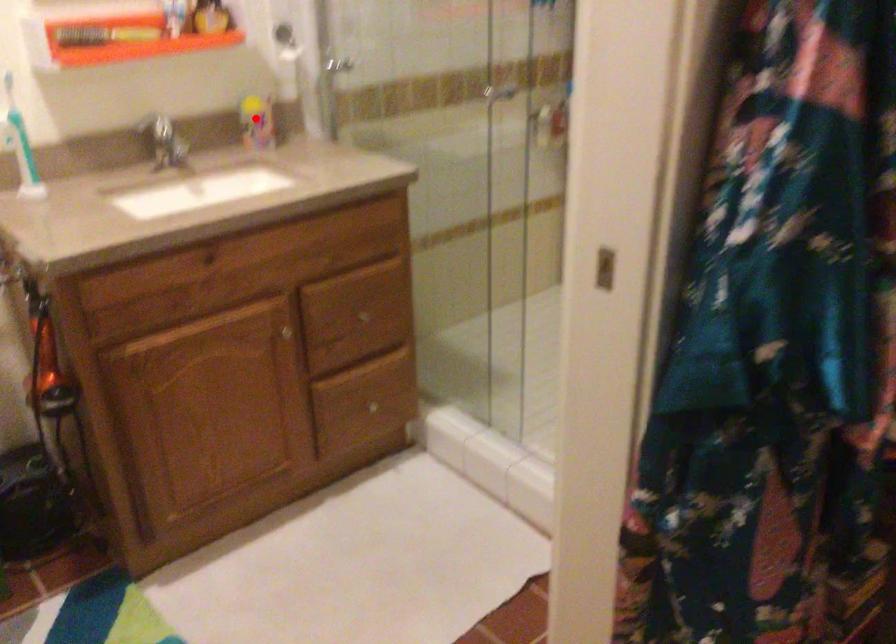
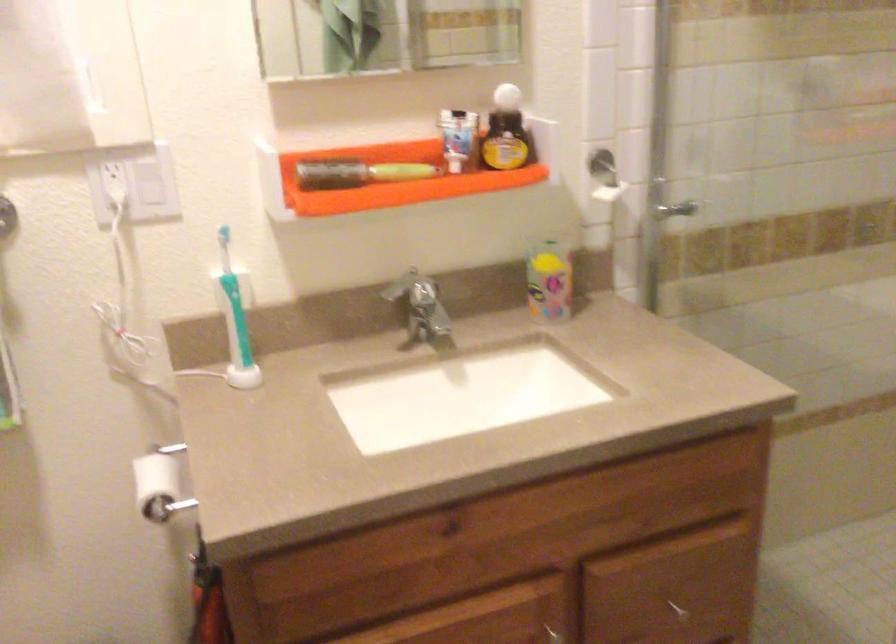
Question: I am providing you with two images of the same scene from different viewpoints. A red point is shown in image1. For the corresponding object point in image2, is it positioned nearer or farther from the camera?

Choices:
 (A) Nearer
 (B) Farther

Answer: (A)